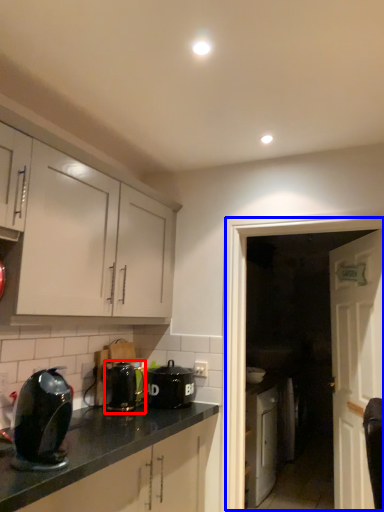
Question: Which point is further to the camera, kitchen appliance (highlighted by a red box) or glass door (highlighted by a blue box)?

Choices:
 (A) kitchen appliance
 (B) glass door

Answer: (A)